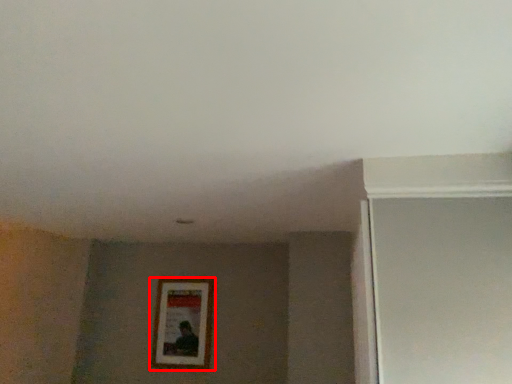
Question: Where is picture frame (annotated by the red box) located in relation to screen door in the image?

Choices:
 (A) right
 (B) left

Answer: (B)